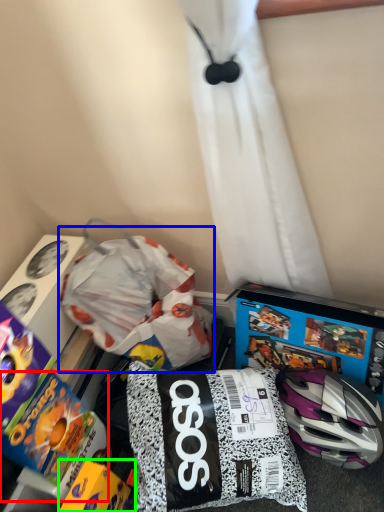
Question: Estimate the real-world distances between objects in this image. Which object is closer to toy (highlighted by a red box), waste (highlighted by a blue box) or toy (highlighted by a green box)?

Choices:
 (A) waste
 (B) toy

Answer: (B)